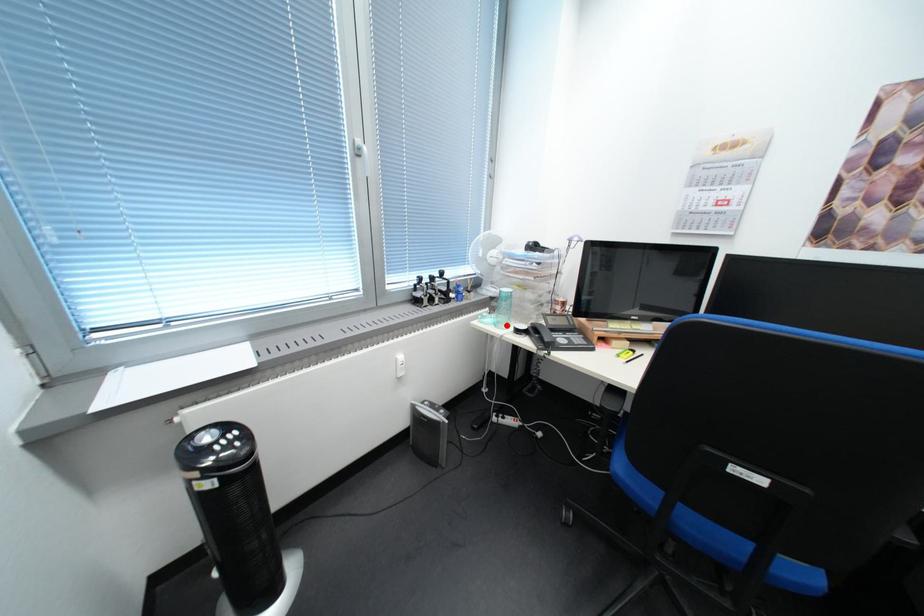
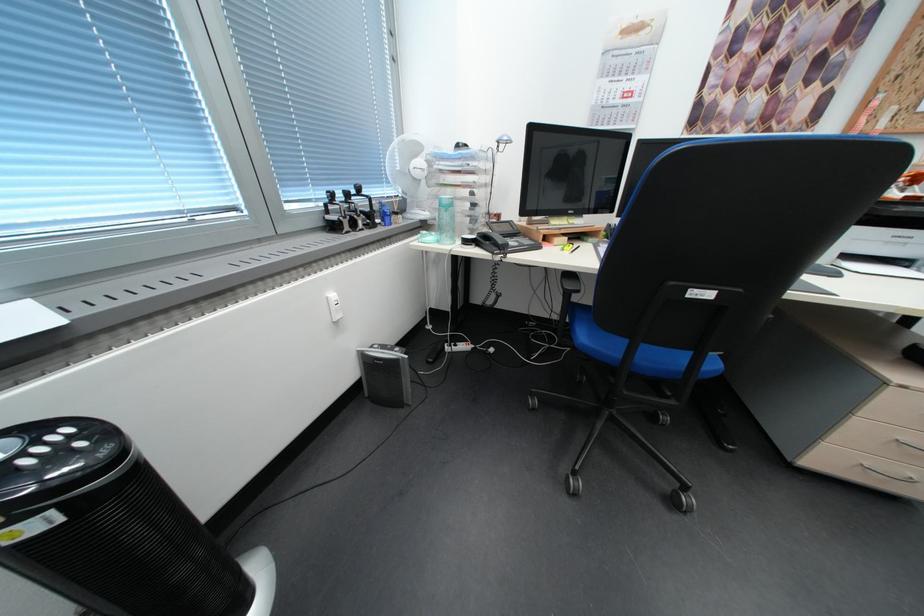
Question: I am providing you with two images of the same scene from different viewpoints. A red point is marked on the first image. Can you still see the location of the red point in image 2?

Choices:
 (A) Yes
 (B) No

Answer: (A)